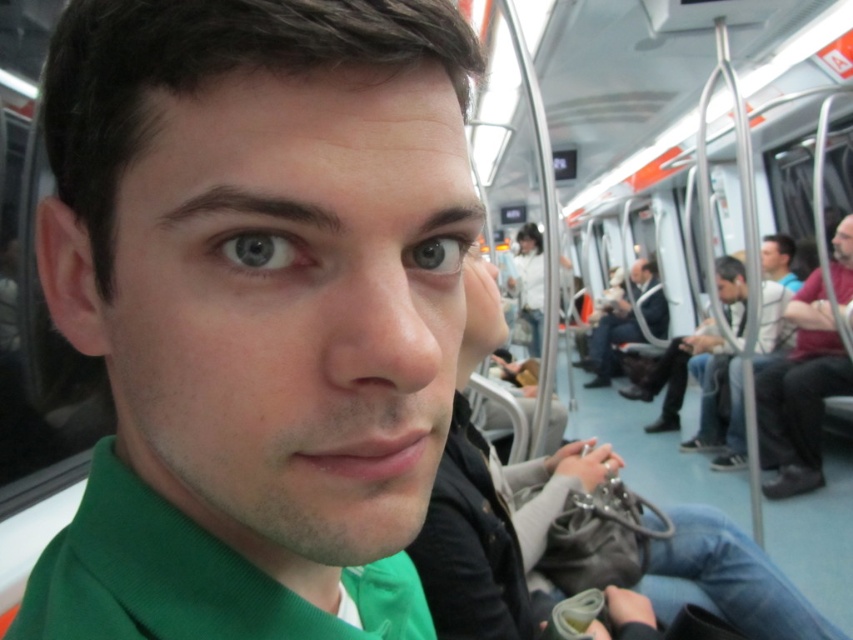
Is dark blue jeans at right further to camera compared to dark blue jacket at center?

No, it is not.

Who is more distant from viewer, (688,344) or (611,307)?

The point (611,307) is more distant.

Locate an element on the screen. The width and height of the screenshot is (853, 640). dark blue jeans at right is located at coordinates (717, 401).

Is green matte sweater at center further to the viewer compared to blue matte eye at center?

No, it is not.

Describe the element at coordinates (253, 308) in the screenshot. The image size is (853, 640). I see `green matte sweater at center` at that location.

Identify the location of green matte sweater at center. This screenshot has width=853, height=640. (253, 308).

Who is more forward, (606, 308) or (434, 259)?

Point (434, 259) is more forward.

Is dark blue jacket at center above blue matte eye at center?

Yes.

Which is in front, point (612, 364) or point (426, 257)?

Point (426, 257) is more forward.

Locate an element on the screen. The width and height of the screenshot is (853, 640). dark blue jacket at center is located at coordinates (611, 340).